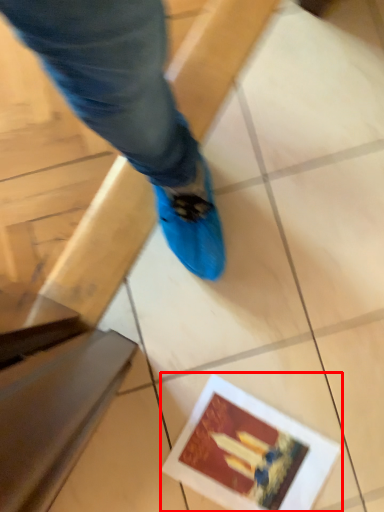
Question: From the image's perspective, considering the relative positions of postcard (annotated by the red box) and tile in the image provided, where is postcard (annotated by the red box) located with respect to the staircase?

Choices:
 (A) below
 (B) above

Answer: (A)